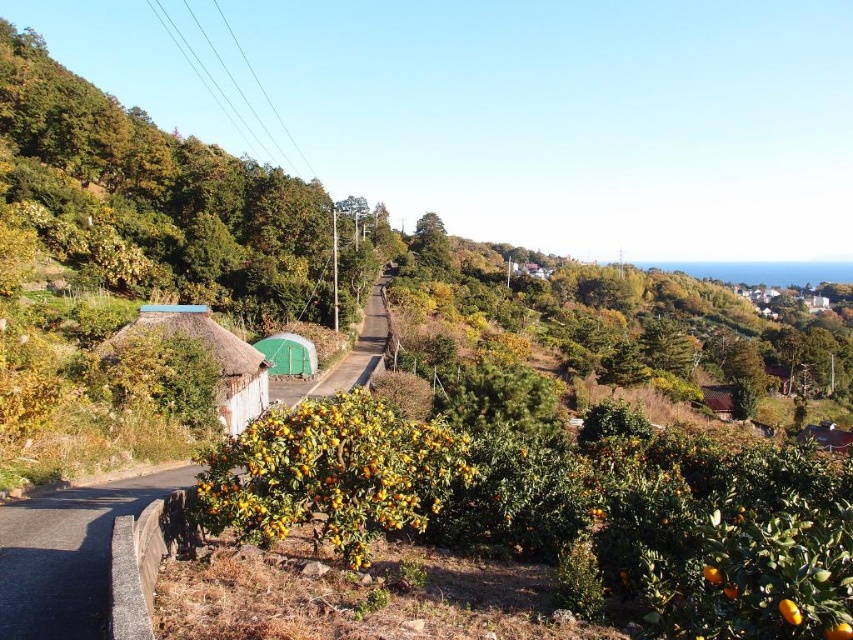
Is green thatch roof at left below white thatch hut at left?

No.

Is point (196, 177) farther from camera compared to point (154, 308)?

Yes, point (196, 177) is behind point (154, 308).

Is point (209, 220) farther from camera compared to point (236, 364)?

Yes, point (209, 220) is farther from viewer.

Where is `green thatch roof at left`? The image size is (853, 640). green thatch roof at left is located at coordinates (161, 195).

This screenshot has width=853, height=640. What do you see at coordinates (332, 474) in the screenshot? I see `yellow-green glossy orange tree at center` at bounding box center [332, 474].

Which is behind, point (383, 428) or point (125, 328)?

Point (125, 328)

Does point (352, 484) come closer to viewer compared to point (222, 392)?

That is True.

Identify the location of yellow-green glossy orange tree at center. (332, 474).

Which of these two, yellow-green glossy orange tree at center or brown thatched hut at upper right, stands taller?

brown thatched hut at upper right

Is yellow-green glossy orange tree at center thinner than brown thatched hut at upper right?

Yes.

This screenshot has width=853, height=640. What do you see at coordinates (332, 474) in the screenshot?
I see `yellow-green glossy orange tree at center` at bounding box center [332, 474].

Locate an element on the screen. The height and width of the screenshot is (640, 853). yellow-green glossy orange tree at center is located at coordinates (332, 474).